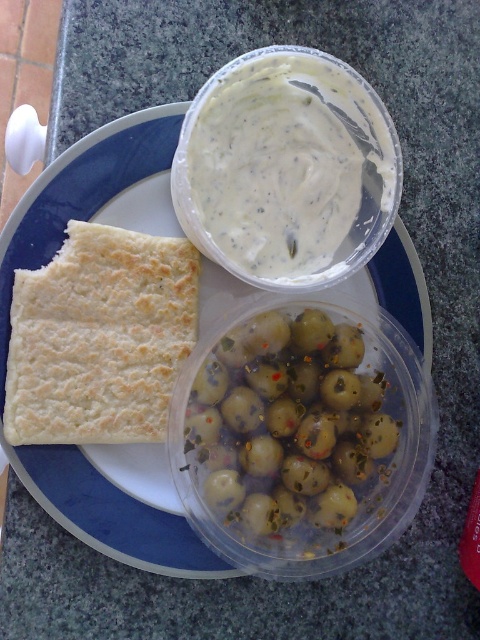
You are a food delivery person who needs to pack this plate into a box. The box has a height limit of 10 cm. Can you determine if the green glossy olives at center and the white crumbly flatbread at left will fit vertically in the box based on their sizes?

The green glossy olives at center has a larger size compared to white crumbly flatbread at left. Since the box has a height limit of 10 cm, we need to know the height of the larger item. However, the description only mentions their relative sizes, not specific measurements. Without knowing the exact height of the green glossy olives at center, it is impossible to determine if they will fit within the 10 cm limit.

You are a food delivery person who needs to place a hot pizza box on the countertop. The pizza box is 30 cm wide. The white matte flatbread at left is located at point (105, 445). Can you place the pizza box on the countertop without overlapping the white matte flatbread at left?

The white matte flatbread at left is located at point (105, 445). Since the pizza box is 30 cm wide, you must ensure there is enough space on the countertop to place it without overlapping the flatbread. However, without knowing the exact dimensions of the countertop or the distance between the flatbread and the edge, it is impossible to determine if there is sufficient space. Please check the available space on the countertop before placing the pizza box.

You are a food delivery person and need to place a package on the dark gray speckled countertop where the plate is located. The package must be placed exactly at the coordinates given in the Objects Description. Where should you place the package in relation to the green glossy olives at center?

The package should be placed exactly at the coordinates provided for the green glossy olives at center, which are located at point (288,422). Since the olives are already at that position, the package should be placed directly where the green glossy olives at center are located.